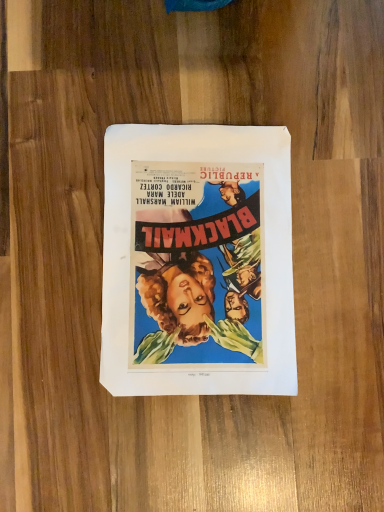
What are the coordinates of `free location above vibrant paper poster at center (from a real-world perspective)` in the screenshot? It's located at (197, 261).